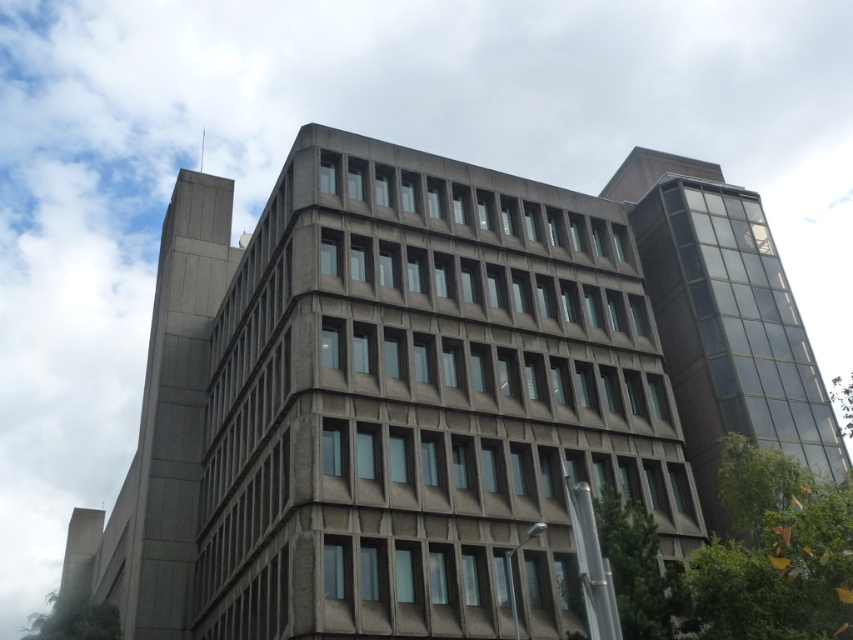
Question: Which of the following is the closest to the observer?

Choices:
 (A) dark glass tower at right
 (B) gray concrete building at center
 (C) gray concrete tower at upper left

Answer: (B)

Question: Among these objects, which one is nearest to the camera?

Choices:
 (A) dark glass tower at right
 (B) gray concrete building at center
 (C) gray concrete tower at upper left

Answer: (B)

Question: Which is nearer to the dark glass tower at right?

Choices:
 (A) gray concrete tower at upper left
 (B) gray concrete building at center

Answer: (B)

Question: Is gray concrete building at center behind gray concrete tower at upper left?

Choices:
 (A) no
 (B) yes

Answer: (A)

Question: Can you confirm if dark glass tower at right is positioned to the left of gray concrete tower at upper left?

Choices:
 (A) no
 (B) yes

Answer: (A)

Question: Does dark glass tower at right have a smaller size compared to gray concrete tower at upper left?

Choices:
 (A) yes
 (B) no

Answer: (A)